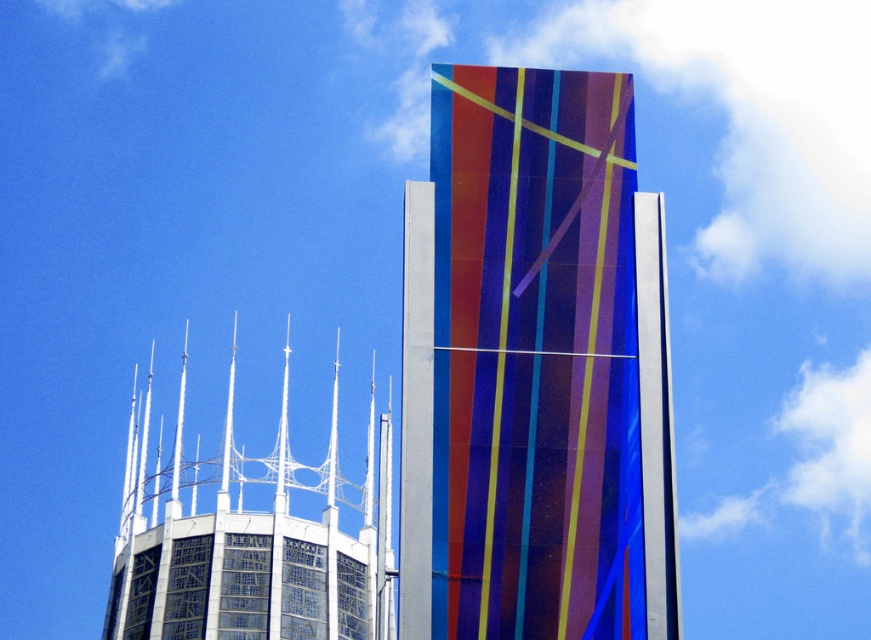
Question: Among these points, which one is nearest to the camera?

Choices:
 (A) (450, 545)
 (B) (274, 449)

Answer: (A)

Question: Can you confirm if translucent glass tower at center is positioned to the left of white glass spires at upper center?

Choices:
 (A) no
 (B) yes

Answer: (A)

Question: Which object is closer to the camera taking this photo?

Choices:
 (A) white glass spires at upper center
 (B) translucent glass tower at center

Answer: (B)

Question: Does translucent glass tower at center appear on the right side of white glass spires at upper center?

Choices:
 (A) yes
 (B) no

Answer: (A)

Question: Does translucent glass tower at center have a smaller size compared to white glass spires at upper center?

Choices:
 (A) yes
 (B) no

Answer: (A)